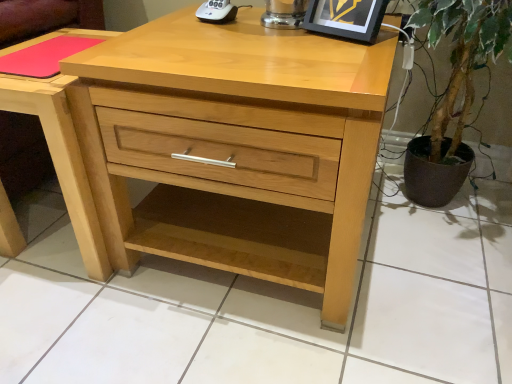
Question: From their relative heights in the image, would you say pink matte mousepad at upper left is taller or shorter than matte black picture frame at upper right?

Choices:
 (A) tall
 (B) short

Answer: (B)

Question: Would you say pink matte mousepad at upper left is to the left or to the right of matte black picture frame at upper right in the picture?

Choices:
 (A) left
 (B) right

Answer: (A)

Question: Which object is positioned closest to the matte black picture frame at upper right?

Choices:
 (A) light wood nightstand at center
 (B) natural wood chest of drawers at center
 (C) pink matte mousepad at upper left
 (D) white plastic remote control at upper center

Answer: (D)

Question: Estimate the real-world distances between objects in this image. Which object is farther from the matte black picture frame at upper right?

Choices:
 (A) natural wood chest of drawers at center
 (B) white plastic remote control at upper center
 (C) light wood nightstand at center
 (D) pink matte mousepad at upper left

Answer: (C)